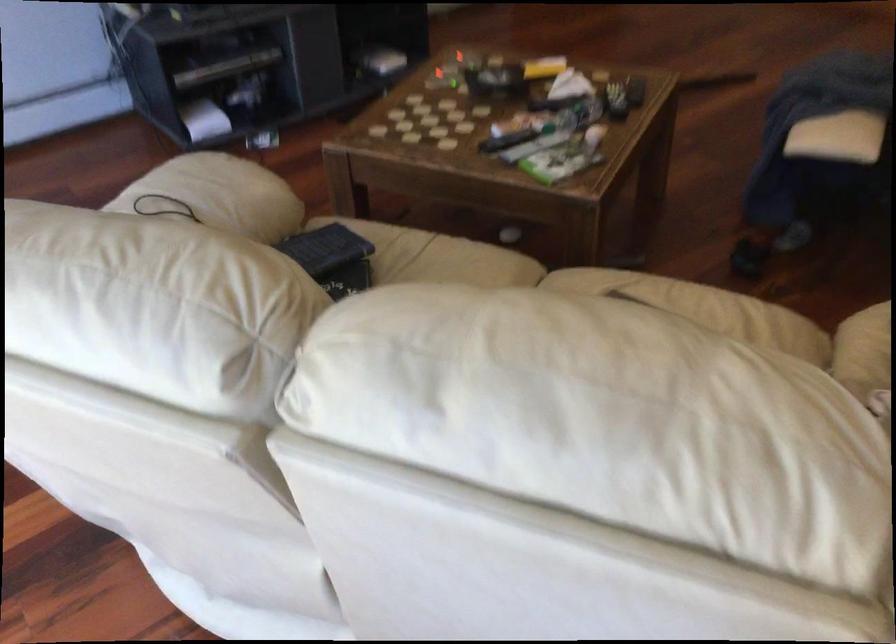
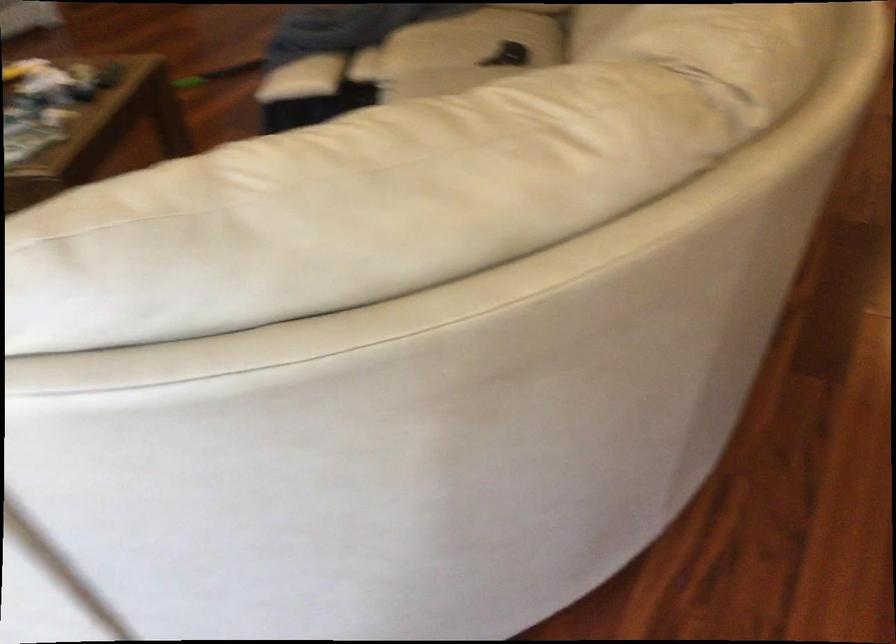
Question: The images are taken continuously from a first-person perspective. In which direction are you moving?

Choices:
 (A) Left
 (B) Right
 (C) Forward
 (D) Backward

Answer: (B)